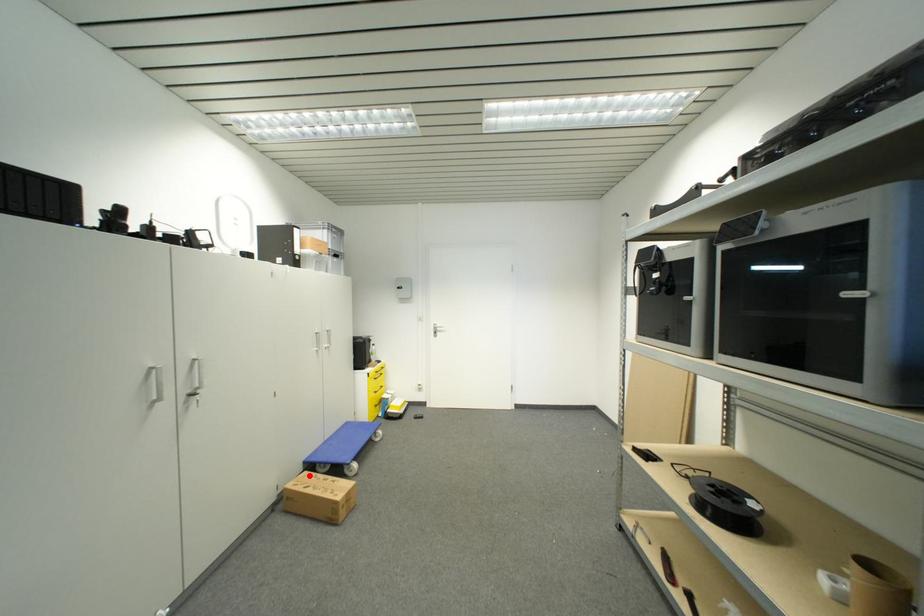
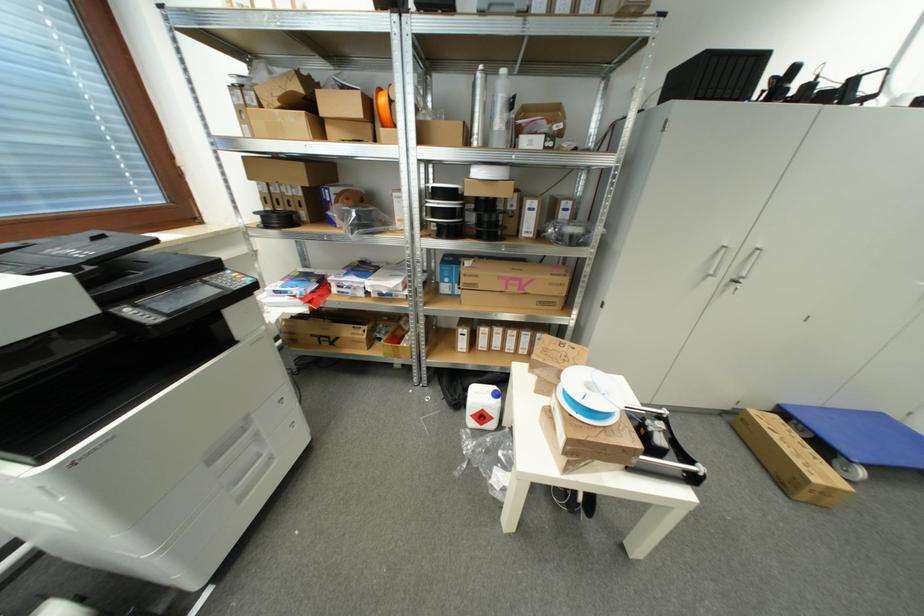
In the second image, find the point that corresponds to the highlighted location in the first image.

(781, 419)